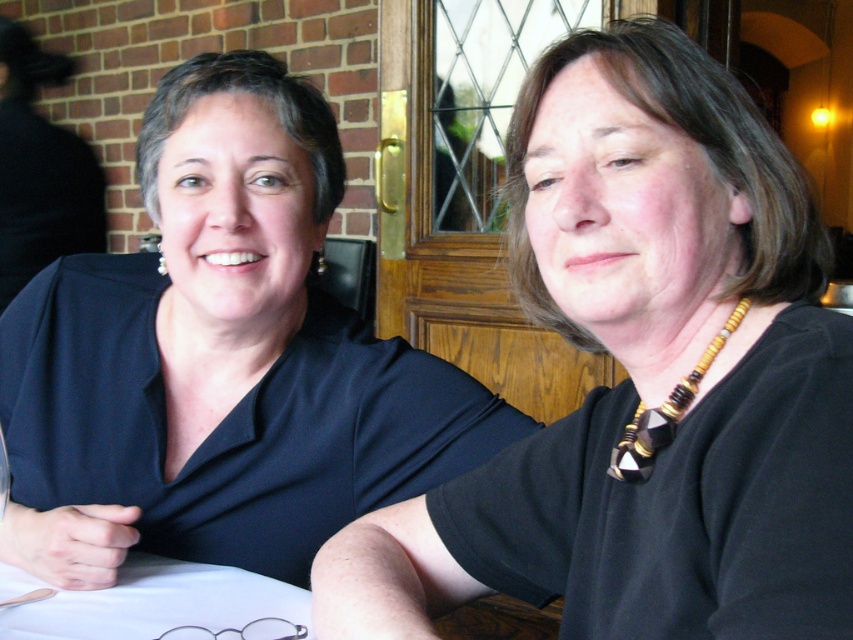
Who is lower down, black matte necklace at upper center or matte black blouse at left?

Positioned lower is black matte necklace at upper center.

Which of these two, black matte necklace at upper center or matte black blouse at left, stands taller?

matte black blouse at left

Between point (595, 422) and point (318, 339), which one is positioned in front?

Point (595, 422) is more forward.

Locate an element on the screen. Image resolution: width=853 pixels, height=640 pixels. black matte necklace at upper center is located at coordinates (645, 378).

Image resolution: width=853 pixels, height=640 pixels. What do you see at coordinates (219, 358) in the screenshot? I see `matte black blouse at left` at bounding box center [219, 358].

Does matte black blouse at left have a greater width compared to white cloth at lower left?

Yes, matte black blouse at left is wider than white cloth at lower left.

Is point (254, 310) less distant than point (244, 579)?

No, it is behind (244, 579).

The width and height of the screenshot is (853, 640). Find the location of `matte black blouse at left`. matte black blouse at left is located at coordinates (219, 358).

Based on the photo, who is lower down, black matte necklace at upper center or white cloth at lower left?

white cloth at lower left

I want to click on black matte necklace at upper center, so click(x=645, y=378).

Find the location of a particular element. Image resolution: width=853 pixels, height=640 pixels. black matte necklace at upper center is located at coordinates pyautogui.click(x=645, y=378).

Where is `black matte necklace at upper center`? black matte necklace at upper center is located at coordinates (645, 378).